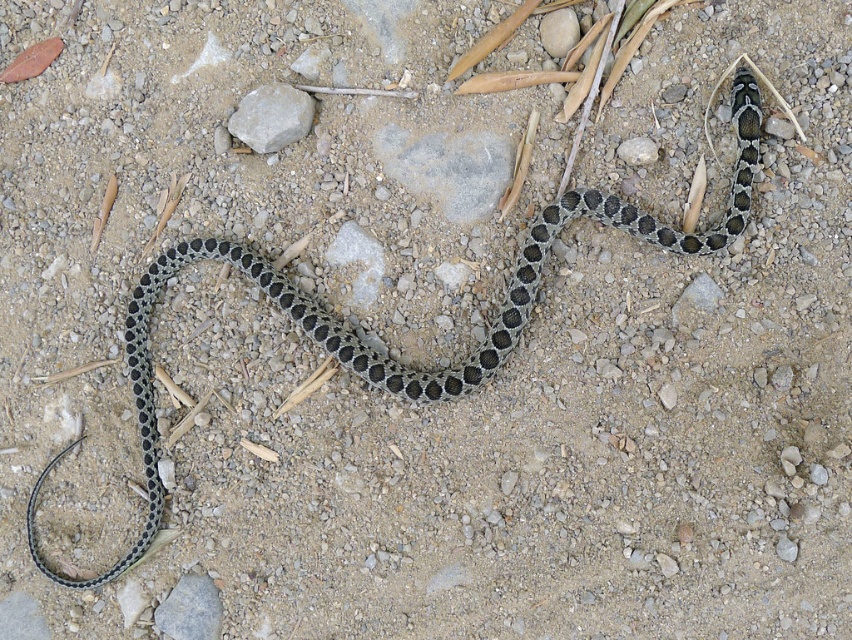
You are a hiker who wants to place a small pebble between the gray rock at center and the gray smooth rock at center. Which rock should you place it closer to if you want the pebble to be higher up?

The gray rock at center is taller than the gray smooth rock at center, so placing the pebble closer to the gray rock at center will result in it being higher up.

You are a hiker who just found two gray rocks in the center of the image. One is labeled as gray rock at center and the other as gray smooth rock at center. According to their positions, which rock is located to the right side?

The gray rock at center is located to the right of the gray smooth rock at center.